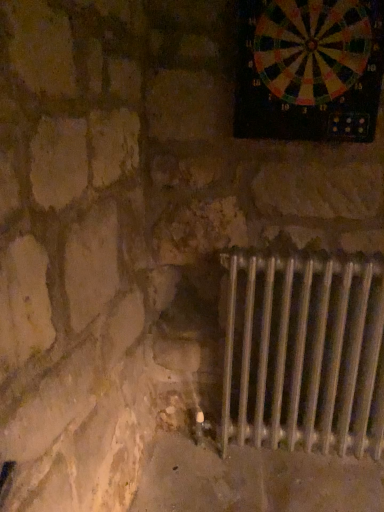
Question: Can you confirm if multicolored plastic dartboard at upper right is taller than silver metallic radiator at lower right?

Choices:
 (A) yes
 (B) no

Answer: (B)

Question: Are multicolored plastic dartboard at upper right and silver metallic radiator at lower right beside each other?

Choices:
 (A) no
 (B) yes

Answer: (A)

Question: Does multicolored plastic dartboard at upper right have a lesser width compared to silver metallic radiator at lower right?

Choices:
 (A) yes
 (B) no

Answer: (A)

Question: From a real-world perspective, is multicolored plastic dartboard at upper right located higher than silver metallic radiator at lower right?

Choices:
 (A) no
 (B) yes

Answer: (B)

Question: Does multicolored plastic dartboard at upper right have a smaller size compared to silver metallic radiator at lower right?

Choices:
 (A) yes
 (B) no

Answer: (A)

Question: Does multicolored plastic dartboard at upper right appear on the left side of silver metallic radiator at lower right?

Choices:
 (A) yes
 (B) no

Answer: (A)

Question: From the image's perspective, is silver metallic radiator at lower right located beneath multicolored plastic dartboard at upper right?

Choices:
 (A) no
 (B) yes

Answer: (B)

Question: From a real-world perspective, is silver metallic radiator at lower right on multicolored plastic dartboard at upper right?

Choices:
 (A) no
 (B) yes

Answer: (A)

Question: Considering the relative positions of silver metallic radiator at lower right and multicolored plastic dartboard at upper right in the image provided, is silver metallic radiator at lower right to the right of multicolored plastic dartboard at upper right from the viewer's perspective?

Choices:
 (A) no
 (B) yes

Answer: (B)

Question: Is silver metallic radiator at lower right positioned far away from multicolored plastic dartboard at upper right?

Choices:
 (A) yes
 (B) no

Answer: (B)

Question: Can you confirm if silver metallic radiator at lower right is positioned to the left of multicolored plastic dartboard at upper right?

Choices:
 (A) no
 (B) yes

Answer: (A)

Question: Is silver metallic radiator at lower right shorter than multicolored plastic dartboard at upper right?

Choices:
 (A) yes
 (B) no

Answer: (B)

Question: From a real-world perspective, is multicolored plastic dartboard at upper right physically located above or below silver metallic radiator at lower right?

Choices:
 (A) above
 (B) below

Answer: (A)